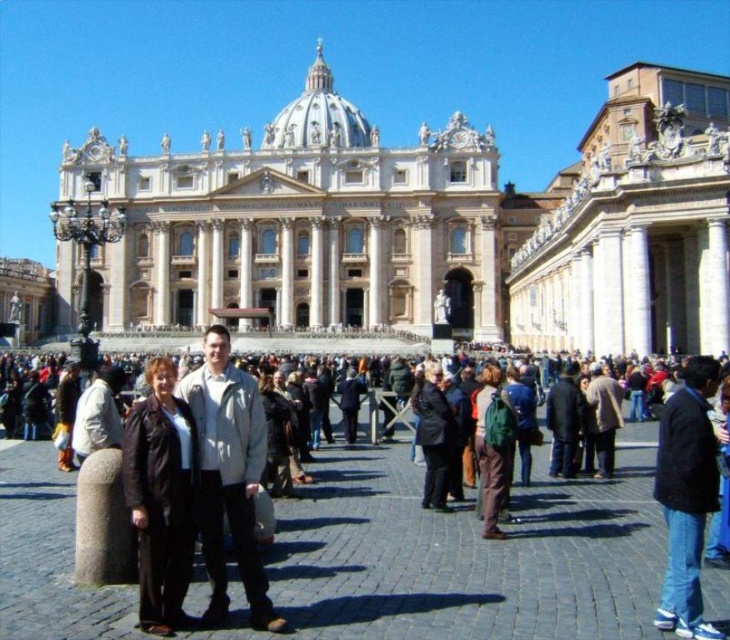
Where is `white marble palace at center`? Image resolution: width=730 pixels, height=640 pixels. white marble palace at center is located at coordinates (299, 225).

Between point (164, 218) and point (696, 541), which one is positioned behind?

Positioned behind is point (164, 218).

Is point (483, 140) positioned before point (687, 435)?

No.

Identify the location of white marble palace at center. (299, 225).

Between point (215, 433) and point (668, 403), which one is positioned in front?

Point (668, 403)

Can you confirm if light gray jacket at center is positioned to the right of dark blue jeans at center?

In fact, light gray jacket at center is to the left of dark blue jeans at center.

At what (x,y) coordinates should I click in order to perform the action: click on light gray jacket at center. Please return your answer as a coordinate pair (x, y). Looking at the image, I should click on (228, 476).

Does white marble palace at center have a lesser width compared to dark clothing crowd at center?

In fact, white marble palace at center might be wider than dark clothing crowd at center.

Is point (242, 198) less distant than point (376, 456)?

No, (242, 198) is further to viewer.

Identify the location of white marble palace at center. The image size is (730, 640). (299, 225).